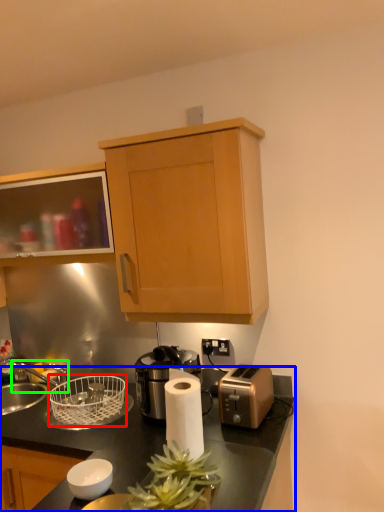
Question: Considering the real-world distances, which object is farthest from basket (highlighted by a red box)? countertop (highlighted by a blue box) or faucet (highlighted by a green box)?

Choices:
 (A) countertop
 (B) faucet

Answer: (B)